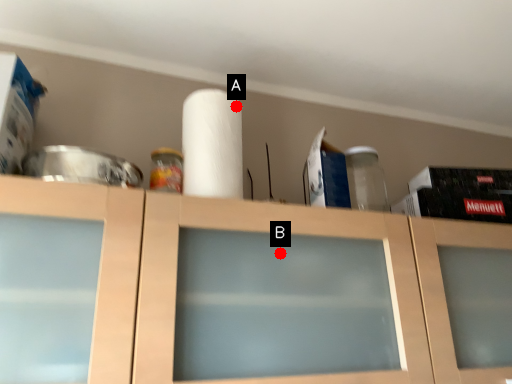
Question: Two points are circled on the image, labeled by A and B beside each circle. Which point is farther from the camera taking this photo?

Choices:
 (A) A is further
 (B) B is further

Answer: (A)